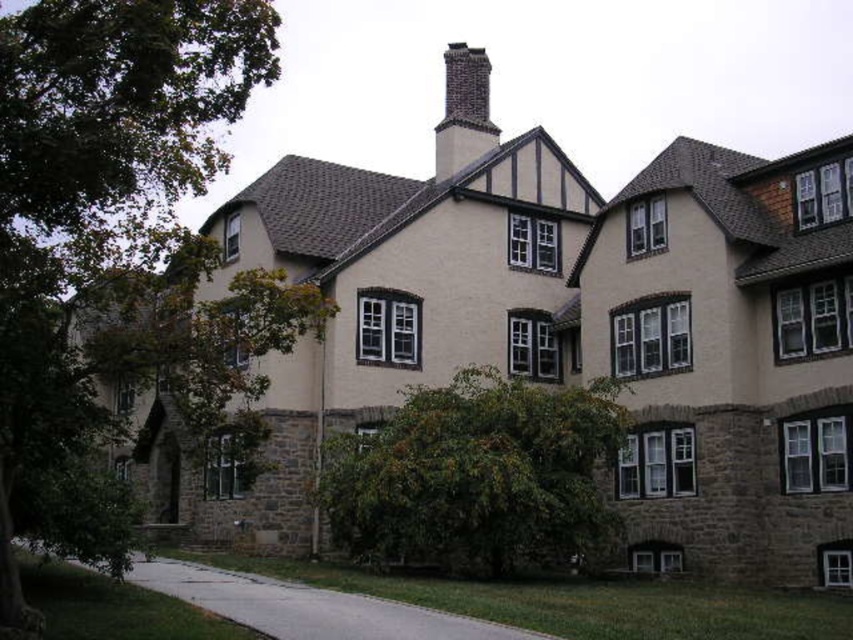
Consider the image. You are standing in front of the building and want to plant a new flower bed between the green leafy tree at left and the green leafy bush at center. Which direction should you move from the tree to reach the area where the flower bed can be placed between them?

To plant the flower bed between the green leafy tree at left and the green leafy bush at center, you should move towards the center from the green leafy tree at left, as the tree is positioned over the bush, meaning the bush is located below it in the scene. The area between them would be directly in front of the tree towards the center where the bush is situated.

Based on the photo, you are standing in front of the large multi story building and you see two points marked on the building. The first point is at coordinate point (289, 612) and the second is at point (486, 67). Which point is closer to you?

Point (289, 612) is in front of point (486, 67), so the first point is closer to you.